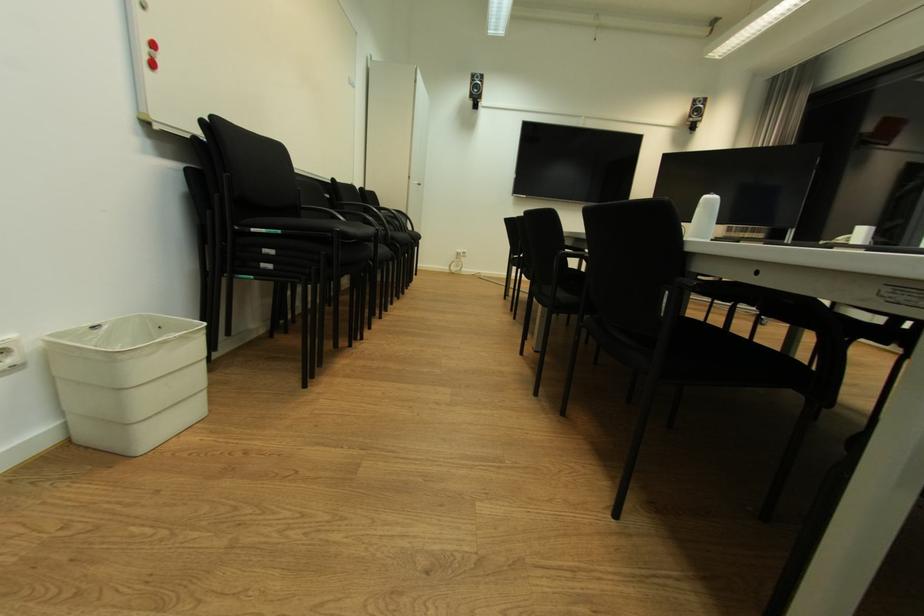
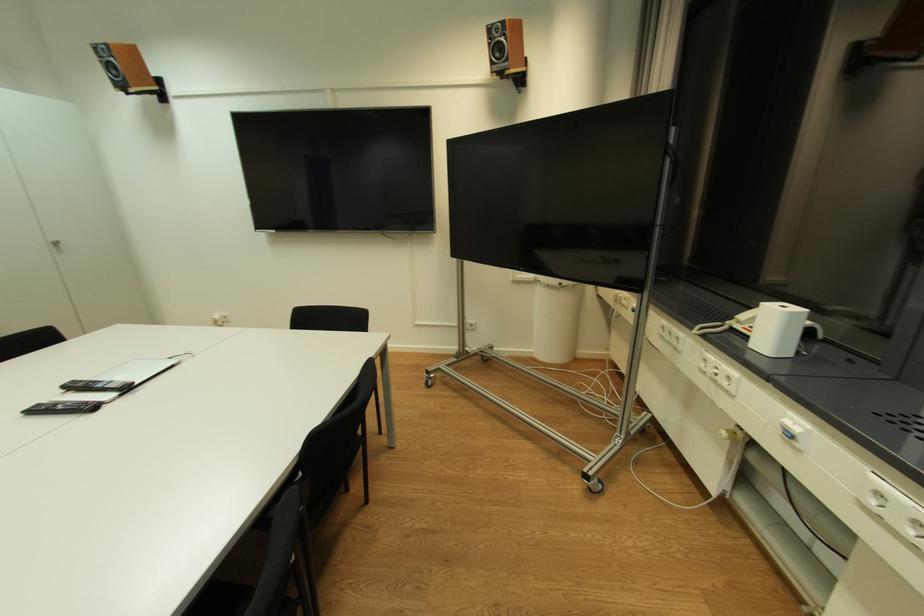
What movement of the cameraman would produce the second image?

The cameraman moved toward right, forward.